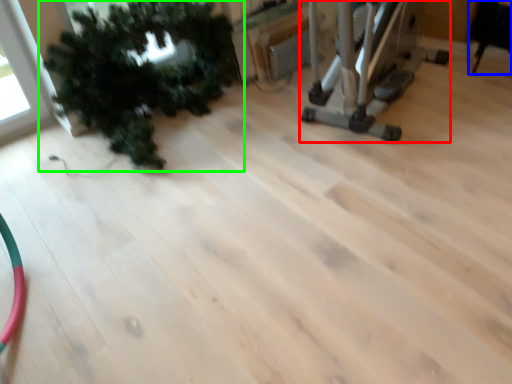
Question: Based on their relative distances, which object is nearer to equipment (highlighted by a red box)? Choose from chair (highlighted by a blue box) and houseplant (highlighted by a green box).

Choices:
 (A) chair
 (B) houseplant

Answer: (A)